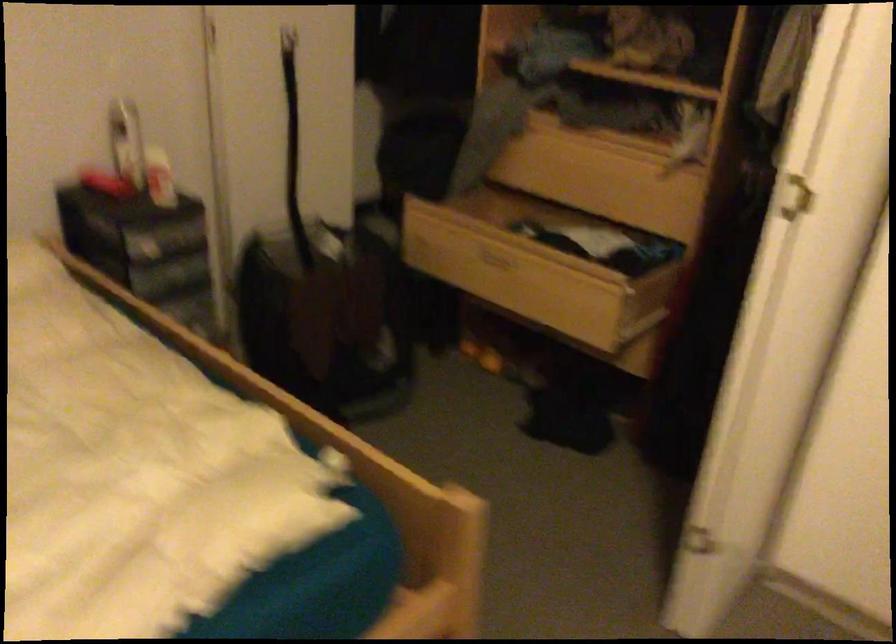
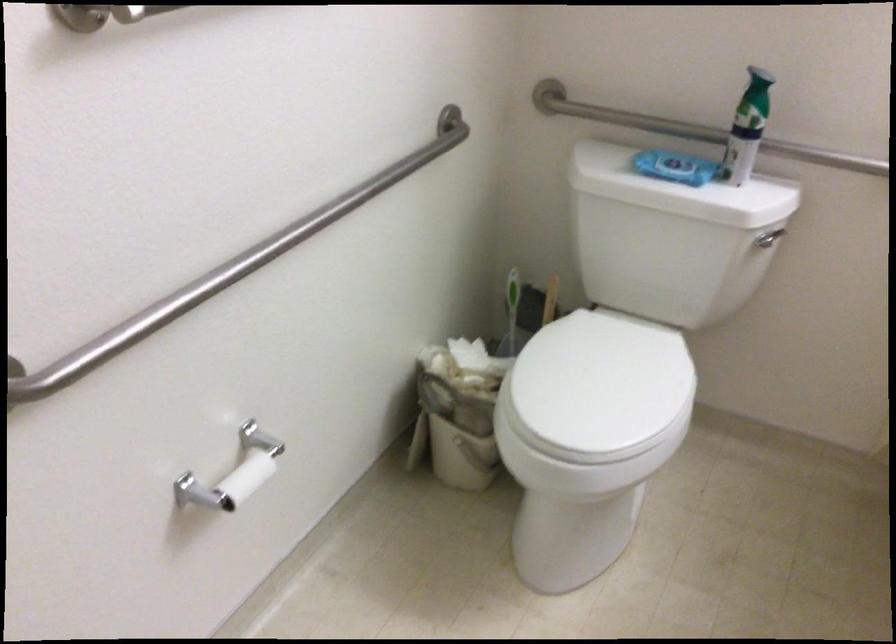
Question: I am providing you with two images of the same scene from different viewpoints. Which of the following objects are not visible in image2?

Choices:
 (A) toilet paper roll
 (B) open wooden drawer
 (C) green spray can
 (D) yellow art canvas

Answer: (B)